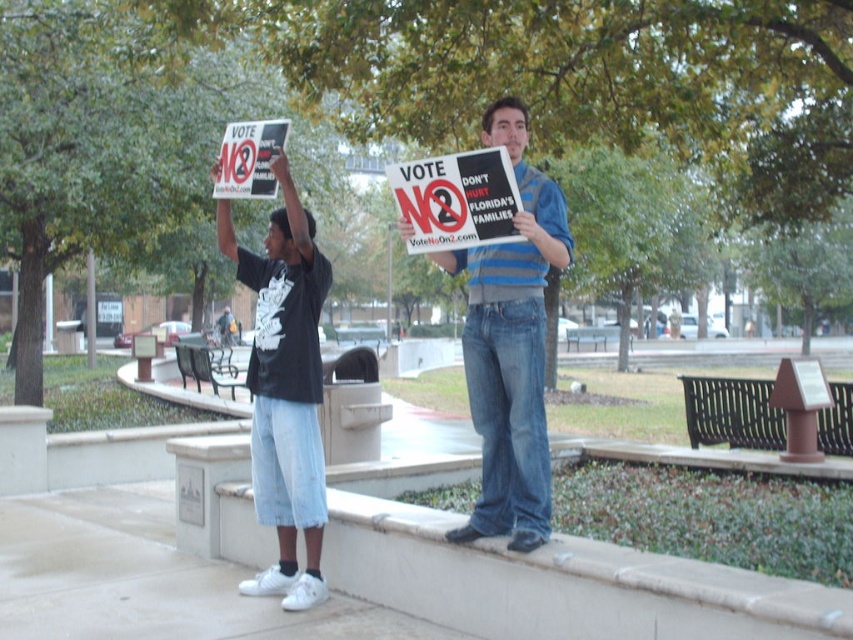
Question: In this image, where is white concrete curb at lower center located relative to blue striped shirt at center?

Choices:
 (A) left
 (B) right

Answer: (B)

Question: Which object is the closest to the matte white sign at center?

Choices:
 (A) matte black t-shirt at left
 (B) white concrete curb at lower center
 (C) blue striped shirt at center
 (D) white paper sign at upper center

Answer: (C)

Question: Estimate the real-world distances between objects in this image. Which object is closer to the white concrete curb at lower center?

Choices:
 (A) blue striped shirt at center
 (B) matte white sign at center

Answer: (A)

Question: Where is white smooth pavement at lower center located in relation to blue striped shirt at center in the image?

Choices:
 (A) left
 (B) right

Answer: (A)

Question: Can you confirm if matte white sign at center is positioned below white paper sign at upper center?

Choices:
 (A) no
 (B) yes

Answer: (B)

Question: Which point is farther to the camera?

Choices:
 (A) white smooth pavement at lower center
 (B) blue striped shirt at center
 (C) matte black t-shirt at left
 (D) white concrete curb at lower center

Answer: (C)